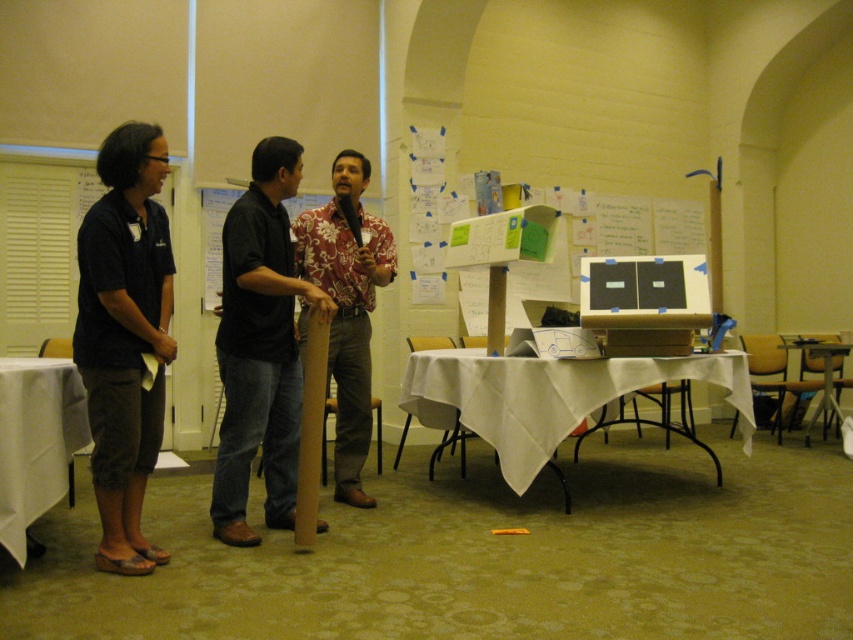
Based on the coordinates provided, which object is located at point (125, 337) in the scene?

The point (125, 337) corresponds to the dark blue shirt at left.

You are standing at point (x=9, y=525) and want to walk to the door located at point (x=345, y=364). Is there a clear path between these two points?

Point (x=345, y=364) is behind point (x=9, y=525), so there is a clear path between them.

You are a photographer standing at a distance of 10 feet from the floral shirt at center. You want to take a photo that includes the entire group without zooming. Should you move closer or farther away?

The floral shirt at center is 11.54 feet away from the camera. Since you are currently 10 feet away, you are closer than the shirt. To include the entire group in the photo without zooming, you should move farther away to ensure all subjects are within frame.